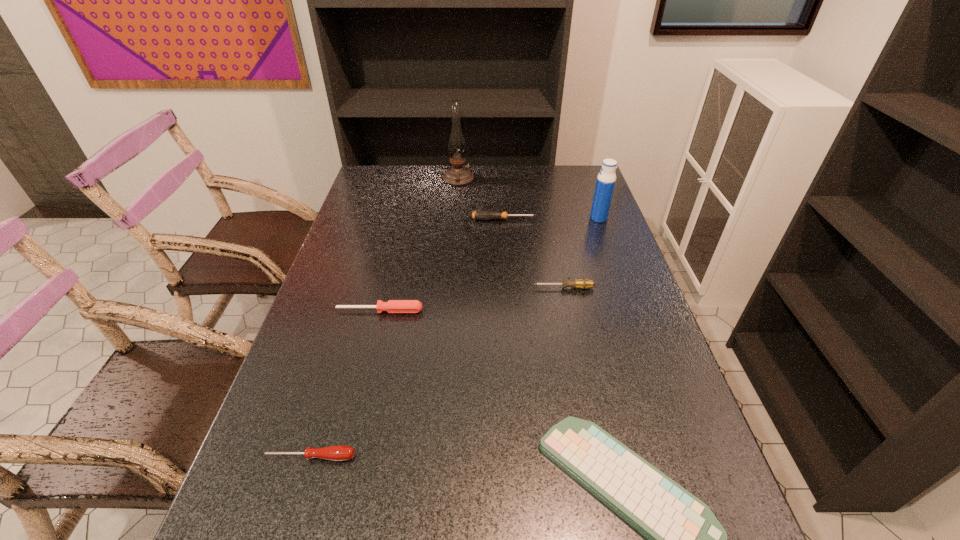
You are a GUI agent. You are given a task and a screenshot of the screen. Output one action in this format:
    pyautogui.click(x=<x>, y=<y>)
    Task: Click on the free space located 0.070m on the right of the third nearest object
    The height and width of the screenshot is (540, 960).
    Given the screenshot: What is the action you would take?
    pyautogui.click(x=449, y=311)

Image resolution: width=960 pixels, height=540 pixels. I want to click on vacant space situated 0.310m at the tip of the fourth nearest object, so click(x=423, y=288).

Locate an element on the screen. The width and height of the screenshot is (960, 540). vacant space located at the tip of the fourth nearest object is located at coordinates (473, 288).

The height and width of the screenshot is (540, 960). Find the location of `free space located at the tip of the fourth nearest object`. free space located at the tip of the fourth nearest object is located at coordinates (396, 288).

Locate an element on the screen. The height and width of the screenshot is (540, 960). vacant space located 0.160m on the back of the nearest screwdriver is located at coordinates (331, 383).

Where is `object present at the far edge`? This screenshot has height=540, width=960. object present at the far edge is located at coordinates (458, 175).

This screenshot has width=960, height=540. Find the location of `water bottle at the right edge`. water bottle at the right edge is located at coordinates (606, 179).

The height and width of the screenshot is (540, 960). I want to click on screwdriver that is at the right edge, so click(582, 283).

Locate an element on the screen. blank space at the far edge of the desktop is located at coordinates (479, 176).

This screenshot has height=540, width=960. Find the location of `vacant space at the left edge`. vacant space at the left edge is located at coordinates (303, 473).